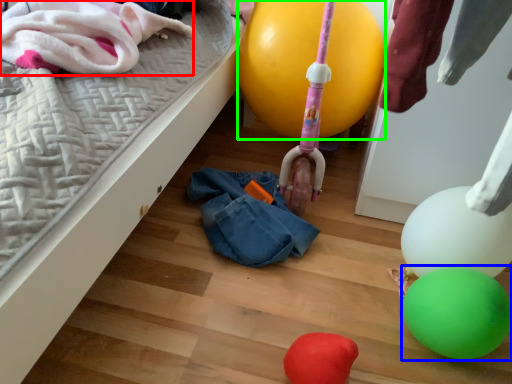
Question: Estimate the real-world distances between objects in this image. Which object is farther from clothing (highlighted by a red box), balloon (highlighted by a blue box) or balloon (highlighted by a green box)?

Choices:
 (A) balloon
 (B) balloon

Answer: (A)